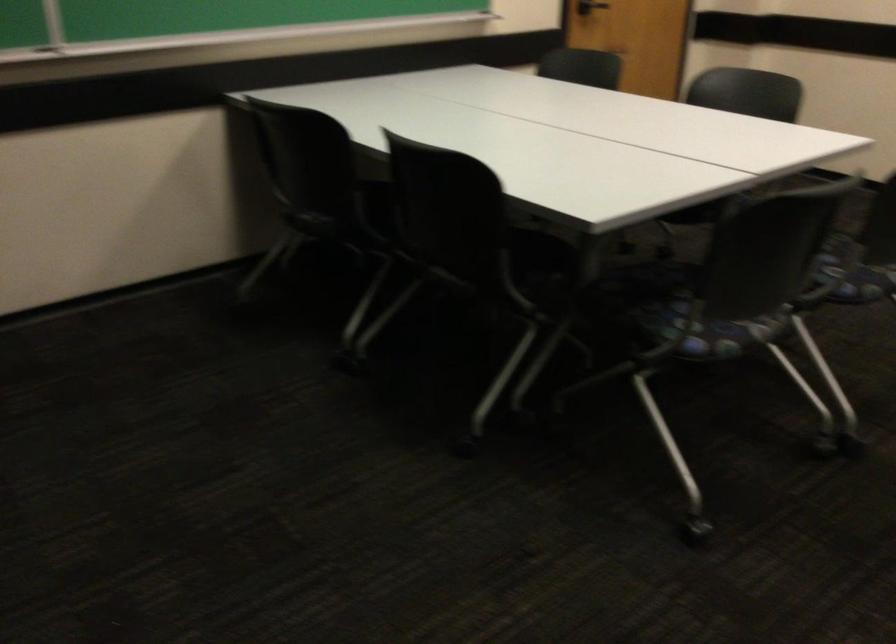
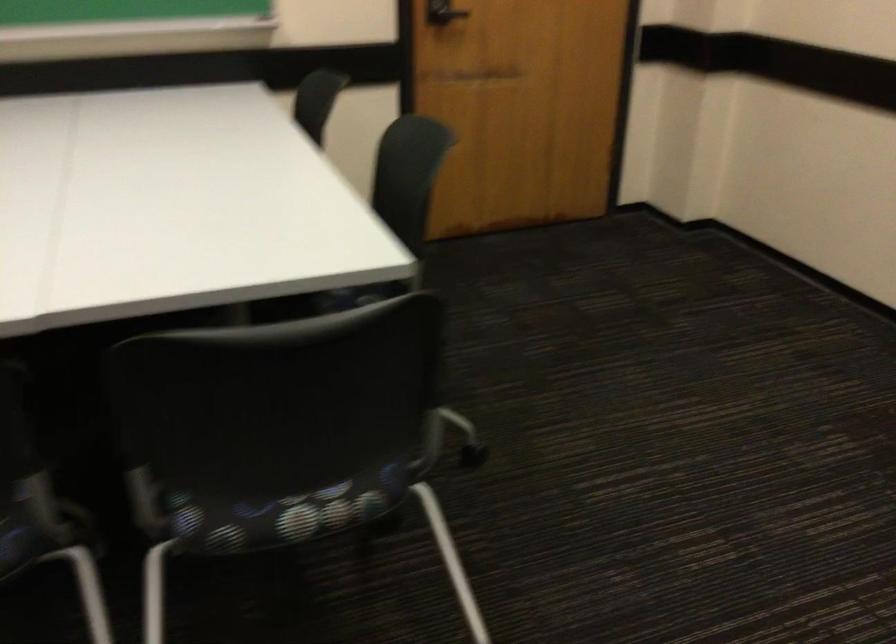
Question: I am providing you with two images of the same scene from different viewpoints. Which of the following objects are not visible in image2?

Choices:
 (A) black door handle
 (B) dresser drawer handle
 (C) black chair sitting surface
 (D) chair sitting surface

Answer: (C)